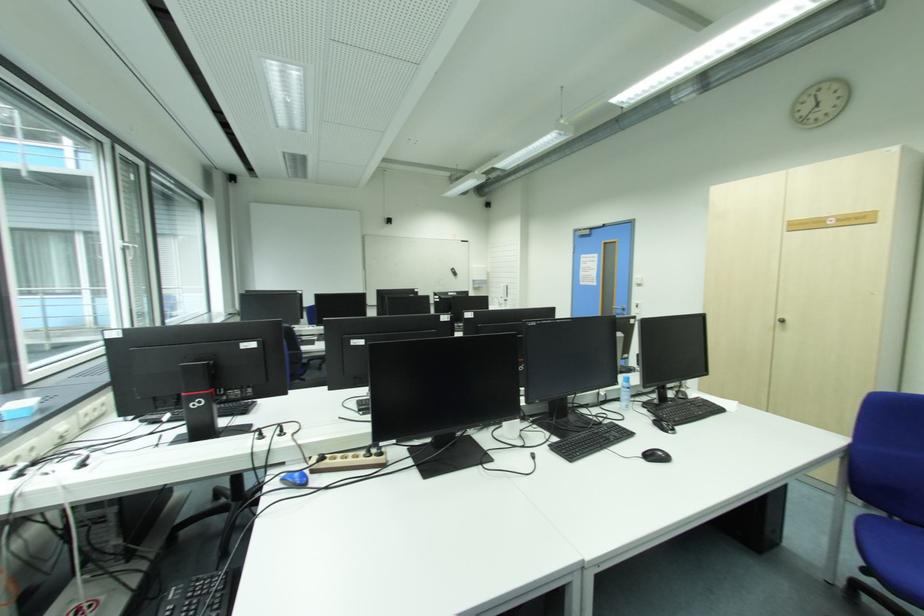
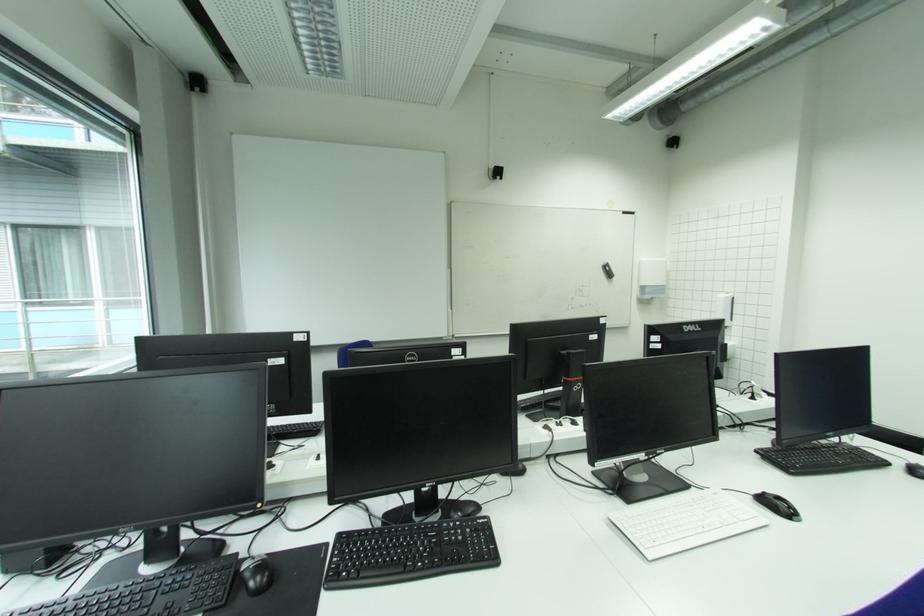
Find the pixel in the second image that matches point (456, 269) in the first image.

(610, 264)